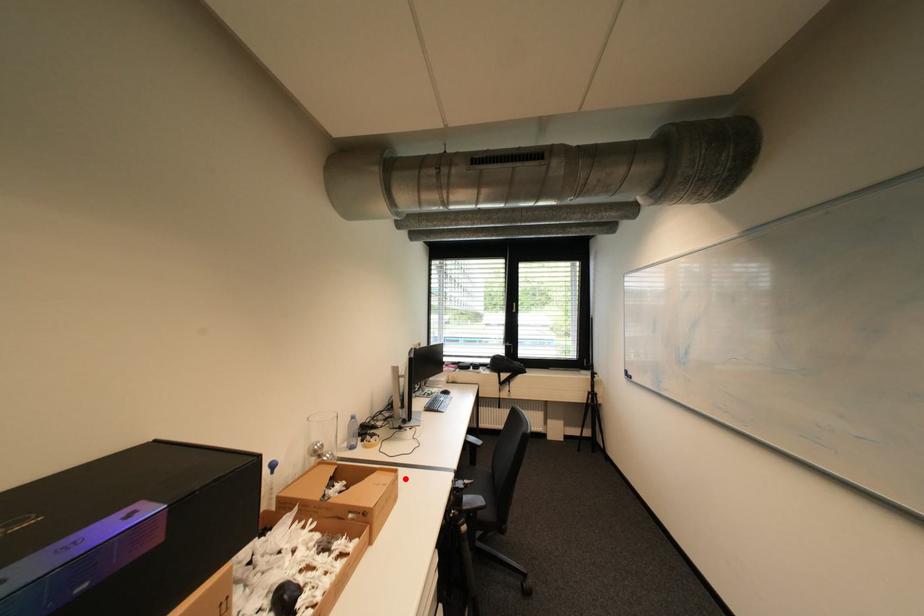
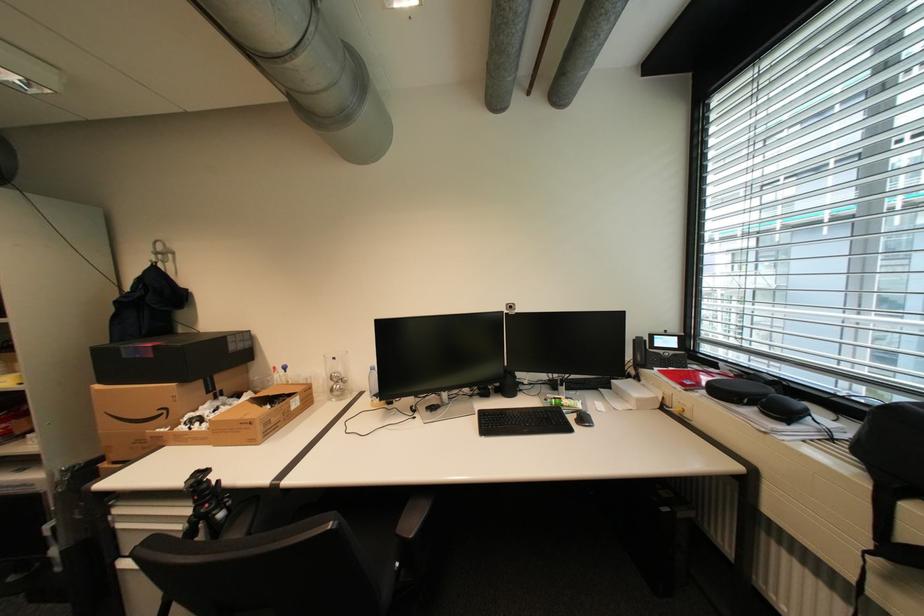
Question: I am providing you with two images of the same scene from different viewpoints. A red point is shown in image1. For the corresponding object point in image2, is it positioned nearer or farther from the camera?

Choices:
 (A) Nearer
 (B) Farther

Answer: (B)